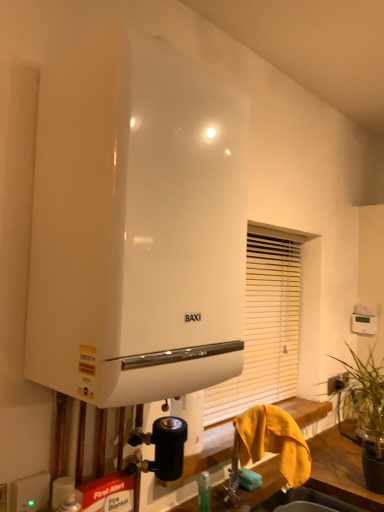
Question: From the image's perspective, is white glossy sink at lower center under white glossy water heater at center?

Choices:
 (A) no
 (B) yes

Answer: (B)

Question: From the image's perspective, would you say white glossy sink at lower center is positioned over white glossy water heater at center?

Choices:
 (A) yes
 (B) no

Answer: (B)

Question: Is white glossy sink at lower center thinner than white glossy water heater at center?

Choices:
 (A) no
 (B) yes

Answer: (B)

Question: Is white glossy sink at lower center facing towards white glossy water heater at center?

Choices:
 (A) yes
 (B) no

Answer: (B)

Question: Can you confirm if white glossy sink at lower center is wider than white glossy water heater at center?

Choices:
 (A) yes
 (B) no

Answer: (B)

Question: Is point (279, 315) closer or farther from the camera than point (342, 502)?

Choices:
 (A) farther
 (B) closer

Answer: (A)

Question: Is white matte shutter at center inside the boundaries of white glossy sink at lower center, or outside?

Choices:
 (A) outside
 (B) inside

Answer: (A)

Question: Would you say white matte shutter at center is to the left or to the right of white glossy sink at lower center in the picture?

Choices:
 (A) right
 (B) left

Answer: (B)

Question: Relative to white glossy sink at lower center, is white matte shutter at center in front or behind?

Choices:
 (A) front
 (B) behind

Answer: (B)

Question: Is white plastic electric outlet at lower left inside the boundaries of white glossy water heater at center, or outside?

Choices:
 (A) outside
 (B) inside

Answer: (A)

Question: Considering the positions of white plastic electric outlet at lower left and white glossy water heater at center in the image, is white plastic electric outlet at lower left bigger or smaller than white glossy water heater at center?

Choices:
 (A) small
 (B) big

Answer: (A)

Question: Looking at their shapes, would you say white plastic electric outlet at lower left is wider or thinner than white glossy water heater at center?

Choices:
 (A) wide
 (B) thin

Answer: (B)

Question: From the image's perspective, is white plastic electric outlet at lower left positioned above or below white glossy water heater at center?

Choices:
 (A) above
 (B) below

Answer: (B)

Question: Considering the relative positions of white matte soap at lower center and green leafy plant at right in the image provided, is white matte soap at lower center to the left or to the right of green leafy plant at right?

Choices:
 (A) right
 (B) left

Answer: (B)

Question: From the image's perspective, relative to green leafy plant at right, is white matte soap at lower center above or below?

Choices:
 (A) below
 (B) above

Answer: (A)